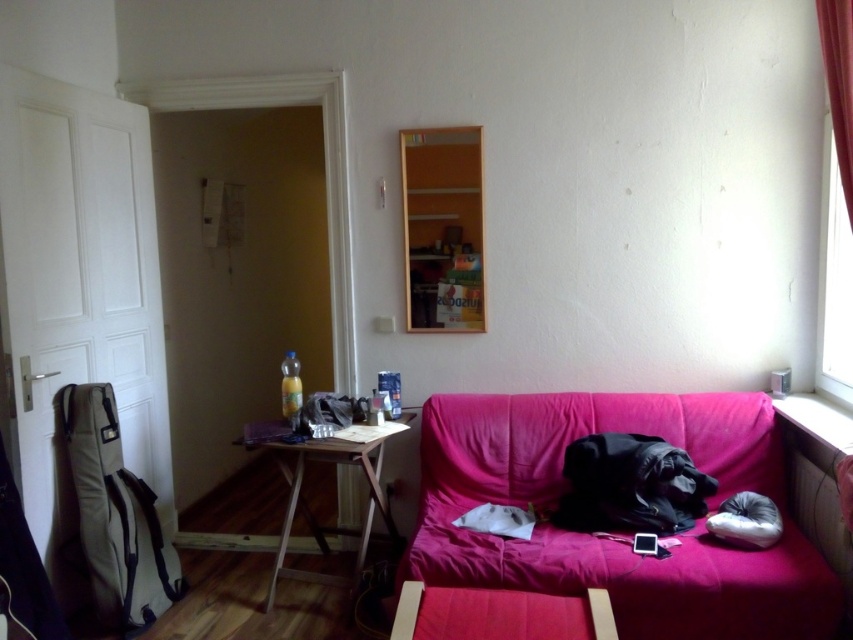
Question: Considering the relative positions of transparent glass window at right and white soft pillow at lower right in the image provided, where is transparent glass window at right located with respect to white soft pillow at lower right?

Choices:
 (A) left
 (B) right

Answer: (B)

Question: Does woodenmaterial/texturetable at center have a lesser width compared to white soft pillow at lower right?

Choices:
 (A) yes
 (B) no

Answer: (B)

Question: Which object is the closest to the red velvet curtain at upper right?

Choices:
 (A) woodenmaterial/texturetable at center
 (B) transparent glass window at right
 (C) white soft pillow at lower right

Answer: (B)

Question: Is pink fabric couch at lower right to the right of woodenmaterial/texturetable at center from the viewer's perspective?

Choices:
 (A) no
 (B) yes

Answer: (B)

Question: Which object is farther from the camera taking this photo?

Choices:
 (A) white soft pillow at lower right
 (B) woodenmaterial/texturetable at center
 (C) transparent glass window at right
 (D) red velvet curtain at upper right

Answer: (C)

Question: Among these points, which one is nearest to the camera?

Choices:
 (A) (827, 225)
 (B) (381, 442)
 (C) (843, 72)
 (D) (578, 422)

Answer: (C)